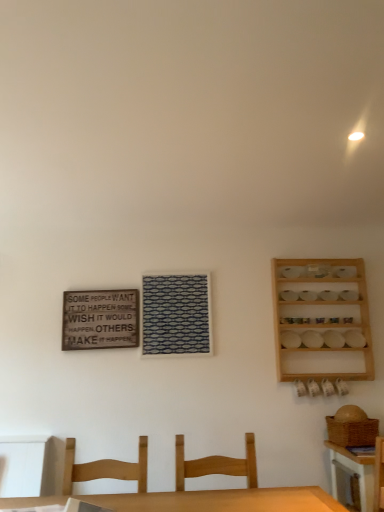
Measure the distance between light brown wood chair at lower center, placed as the second chair when sorted from right to left, and camera.

light brown wood chair at lower center, placed as the second chair when sorted from right to left, is 6.78 feet away from camera.

You are a GUI agent. You are given a task and a screenshot of the screen. Output one action in this format:
    pyautogui.click(x=<x>, y=<y>)
    Task: Click on the wooden table at lower right
    The image size is (384, 512).
    Given the screenshot: What is the action you would take?
    pyautogui.click(x=352, y=474)

Image resolution: width=384 pixels, height=512 pixels. Describe the element at coordinates (352, 474) in the screenshot. I see `wooden table at lower right` at that location.

The height and width of the screenshot is (512, 384). Identify the location of light brown wood chair at lower center, placed as the second chair when sorted from right to left. tap(105, 468).

Would you say wooden table at lower right is to the left or to the right of light brown wood chair at lower center, the first chair positioned from the left, in the picture?

wooden table at lower right is to the right of light brown wood chair at lower center, the first chair positioned from the left.

Considering the points (334, 456) and (77, 465), which point is in front, point (334, 456) or point (77, 465)?

The point (77, 465) is closer to the camera.

From the image's perspective, who appears lower, wooden table at lower right or light brown wood chair at lower center, placed as the second chair when sorted from right to left?

wooden table at lower right appears lower in the image.

Which point is more forward, (85, 298) or (357, 474)?

The point (357, 474) is more forward.

Which object is positioned more to the right, wooden signboard at upper left or wooden table at lower right?

From the viewer's perspective, wooden table at lower right appears more on the right side.

Considering the sizes of objects wooden signboard at upper left and wooden table at lower right in the image provided, who is smaller, wooden signboard at upper left or wooden table at lower right?

wooden signboard at upper left.

Based on the photo, can you confirm if wooden signboard at upper left is shorter than wooden table at lower right?

Yes, wooden signboard at upper left is shorter than wooden table at lower right.

Can you confirm if wooden table at lower right is shorter than wooden signboard at upper left?

No, wooden table at lower right is not shorter than wooden signboard at upper left.

Is wooden table at lower right to the right of wooden signboard at upper left from the viewer's perspective?

Indeed, wooden table at lower right is positioned on the right side of wooden signboard at upper left.

Does point (334, 456) lie in front of point (105, 332)?

Yes.

Which of these two, wooden table at lower right or wooden signboard at upper left, is thinner?

wooden signboard at upper left.

In terms of height, does wooden spice rack at right look taller or shorter compared to light brown wood chair at lower center, the first chair positioned from the left?

Considering their sizes, wooden spice rack at right has more height than light brown wood chair at lower center, the first chair positioned from the left.

Could you tell me if wooden spice rack at right is turned towards light brown wood chair at lower center, placed as the second chair when sorted from right to left?

No.

Is wooden spice rack at right with light brown wood chair at lower center, the first chair positioned from the left?

There is a gap between wooden spice rack at right and light brown wood chair at lower center, the first chair positioned from the left.

Can you confirm if wooden spice rack at right is wider than light brown wood chair at lower center, placed as the second chair when sorted from right to left?

Incorrect, the width of wooden spice rack at right does not surpass that of light brown wood chair at lower center, placed as the second chair when sorted from right to left.

Is wooden chair at center, the 1th chair when ordered from right to left, facing towards light brown wood chair at lower center, the first chair positioned from the left?

No.

Would you say wooden chair at center, positioned as the second chair in left-to-right order, is a long distance from light brown wood chair at lower center, the first chair positioned from the left?

No, wooden chair at center, positioned as the second chair in left-to-right order, is not far away from light brown wood chair at lower center, the first chair positioned from the left.

Considering the sizes of objects wooden chair at center, the 1th chair when ordered from right to left, and light brown wood chair at lower center, the first chair positioned from the left, in the image provided, who is thinner, wooden chair at center, the 1th chair when ordered from right to left, or light brown wood chair at lower center, the first chair positioned from the left,?

light brown wood chair at lower center, the first chair positioned from the left.

Is wooden spice rack at right further to the viewer compared to wooden table at lower right?

Yes, it is behind wooden table at lower right.

From their relative heights in the image, would you say wooden spice rack at right is taller or shorter than wooden table at lower right?

wooden spice rack at right is taller than wooden table at lower right.

From the image's perspective, which one is positioned lower, wooden spice rack at right or wooden table at lower right?

From the image's view, wooden table at lower right is below.

Is wooden spice rack at right far away from wooden table at lower right?

That's not correct — wooden spice rack at right is a little close to wooden table at lower right.

Does light brown wood chair at lower center, the first chair positioned from the left, touch wooden chair at center, the 1th chair when ordered from right to left?

No, light brown wood chair at lower center, the first chair positioned from the left, is not next to wooden chair at center, the 1th chair when ordered from right to left.

Is light brown wood chair at lower center, the first chair positioned from the left, smaller than wooden chair at center, the 1th chair when ordered from right to left?

Correct, light brown wood chair at lower center, the first chair positioned from the left, occupies less space than wooden chair at center, the 1th chair when ordered from right to left.

Considering the positions of objects light brown wood chair at lower center, the first chair positioned from the left, and wooden chair at center, positioned as the second chair in left-to-right order, in the image provided, who is behind, light brown wood chair at lower center, the first chair positioned from the left, or wooden chair at center, positioned as the second chair in left-to-right order,?

wooden chair at center, positioned as the second chair in left-to-right order, is behind.

Image resolution: width=384 pixels, height=512 pixels. I want to click on chair above the wooden chair at center, the 1th chair when ordered from right to left (from a real-world perspective), so click(x=105, y=468).

From a real-world perspective, count 2nd chairs upward from the wooden table at lower right and point to it. Please provide its 2D coordinates.

[(105, 468)]

Locate an element on the screen. table that is under the wooden signboard at upper left (from a real-world perspective) is located at coordinates (352, 474).

Considering their positions, is wooden spice rack at right positioned further to wooden signboard at upper left than wooden table at lower right?

Among the two, wooden table at lower right is located further to wooden signboard at upper left.

Estimate the real-world distances between objects in this image. Which object is closer to wooden spice rack at right, light brown wood chair at lower center, the first chair positioned from the left, or wooden table at lower right?

wooden table at lower right is positioned closer to the anchor wooden spice rack at right.

From the picture: From the image, which object appears to be farther from wooden table at lower right, wooden signboard at upper left or wooden spice rack at right?

wooden signboard at upper left is positioned further to the anchor wooden table at lower right.

Based on their spatial positions, is light brown wood chair at lower center, the first chair positioned from the left, or wooden chair at center, the 1th chair when ordered from right to left, closer to wooden table at lower right?

Based on the image, wooden chair at center, the 1th chair when ordered from right to left, appears to be nearer to wooden table at lower right.

Considering their positions, is wooden spice rack at right positioned further to wooden table at lower right than light brown wood chair at lower center, the first chair positioned from the left?

Based on the image, light brown wood chair at lower center, the first chair positioned from the left, appears to be further to wooden table at lower right.

From the picture: Considering their positions, is wooden chair at center, the 1th chair when ordered from right to left, positioned further to wooden signboard at upper left than light brown wood chair at lower center, the first chair positioned from the left?

Based on the image, wooden chair at center, the 1th chair when ordered from right to left, appears to be further to wooden signboard at upper left.

Looking at the image, which one is located closer to wooden spice rack at right, wooden signboard at upper left or wooden chair at center, positioned as the second chair in left-to-right order?

wooden chair at center, positioned as the second chair in left-to-right order, is closer to wooden spice rack at right.

From the image, which object appears to be farther from wooden table at lower right, light brown wood chair at lower center, the first chair positioned from the left, or wooden spice rack at right?

light brown wood chair at lower center, the first chair positioned from the left, is further to wooden table at lower right.

I want to click on shelf between wooden signboard at upper left and wooden table at lower right, so click(321, 320).

In order to click on shelf located between light brown wood chair at lower center, the first chair positioned from the left, and wooden table at lower right in the left-right direction in this screenshot , I will do `click(321, 320)`.

Identify the location of chair positioned between light brown wood chair at lower center, the first chair positioned from the left, and wooden signboard at upper left from near to far. (216, 464).

Locate an element on the screen. The height and width of the screenshot is (512, 384). chair between light brown wood chair at lower center, placed as the second chair when sorted from right to left, and wooden spice rack at right is located at coordinates (216, 464).